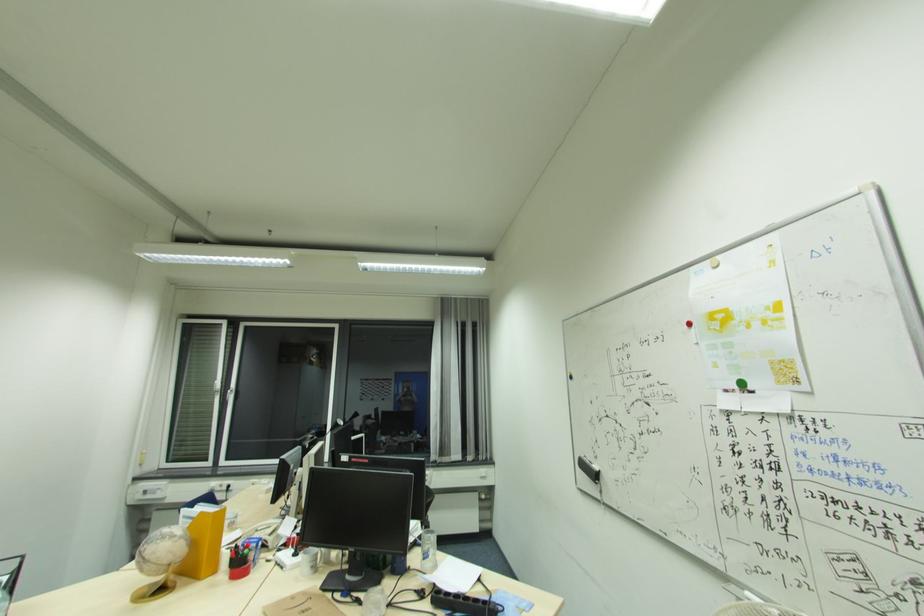
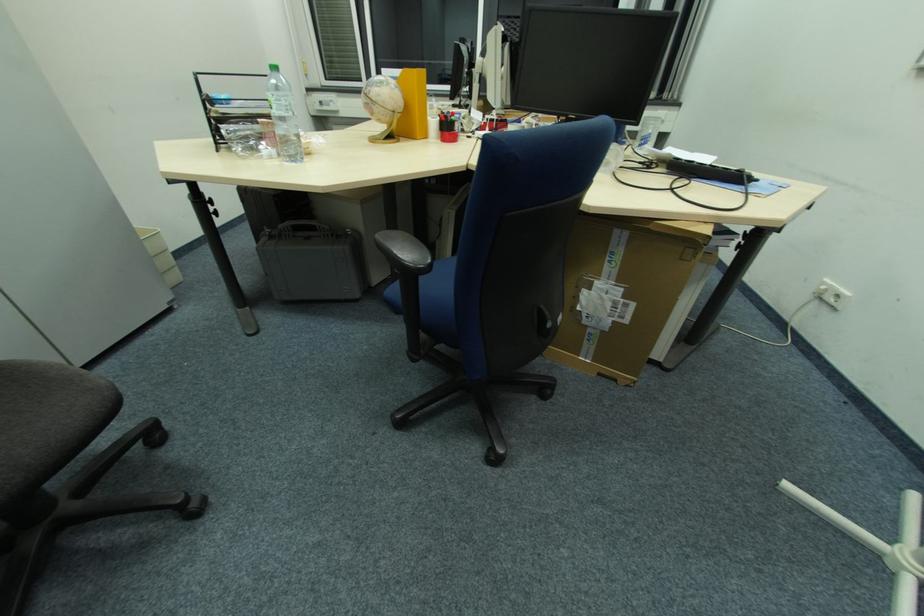
How did the camera likely rotate?

The rotation direction of the camera is left-down.